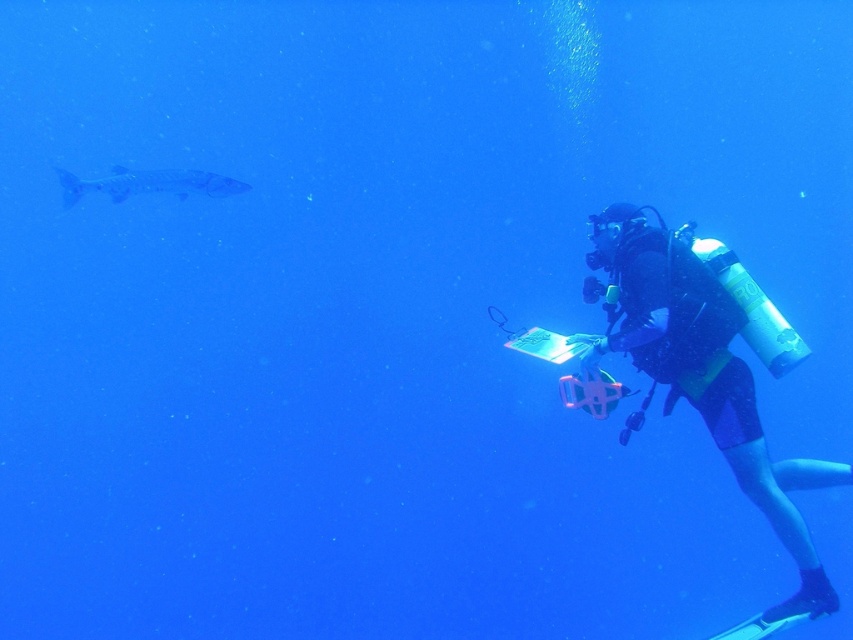
Between black rubber wetsuit at right and smooth blue fish at left, which one is positioned higher?

Positioned higher is smooth blue fish at left.

Between point (718, 358) and point (193, 179), which one is positioned in front?

Point (718, 358)

The height and width of the screenshot is (640, 853). Find the location of `black rubber wetsuit at right`. black rubber wetsuit at right is located at coordinates (706, 376).

Locate an element on the screen. The width and height of the screenshot is (853, 640). black rubber wetsuit at right is located at coordinates point(706,376).